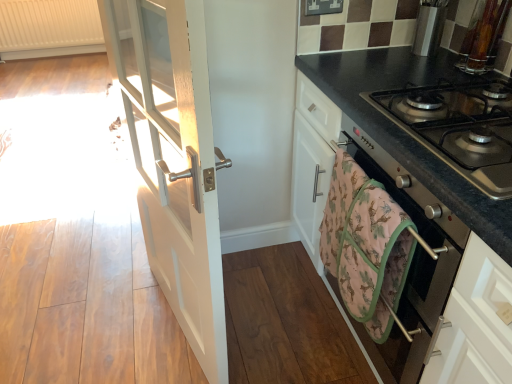
Question: Is the position of white wood door at left less distant than that of pink fabric hand towel at lower right?

Choices:
 (A) yes
 (B) no

Answer: (A)

Question: Could you tell me if white wood door at left is facing pink fabric hand towel at lower right?

Choices:
 (A) yes
 (B) no

Answer: (B)

Question: Is white wood door at left wider than pink fabric hand towel at lower right?

Choices:
 (A) no
 (B) yes

Answer: (A)

Question: Can you confirm if white wood door at left is bigger than pink fabric hand towel at lower right?

Choices:
 (A) no
 (B) yes

Answer: (B)

Question: Does white wood door at left have a lesser height compared to pink fabric hand towel at lower right?

Choices:
 (A) yes
 (B) no

Answer: (B)

Question: Is white wood door at left positioned far away from pink fabric hand towel at lower right?

Choices:
 (A) no
 (B) yes

Answer: (A)

Question: Is white wood door at left turned away from stainless steel gas stove at right?

Choices:
 (A) no
 (B) yes

Answer: (B)

Question: Is white wood door at left at the left side of stainless steel gas stove at right?

Choices:
 (A) no
 (B) yes

Answer: (B)

Question: Can we say white wood door at left lies outside stainless steel gas stove at right?

Choices:
 (A) no
 (B) yes

Answer: (B)

Question: Considering the relative sizes of white wood door at left and stainless steel gas stove at right in the image provided, is white wood door at left thinner than stainless steel gas stove at right?

Choices:
 (A) yes
 (B) no

Answer: (A)

Question: Is white wood door at left shorter than stainless steel gas stove at right?

Choices:
 (A) yes
 (B) no

Answer: (B)

Question: Can you confirm if white wood door at left is positioned to the right of stainless steel gas stove at right?

Choices:
 (A) yes
 (B) no

Answer: (B)

Question: Is white wood door at left outside of white textured radiator at upper left?

Choices:
 (A) no
 (B) yes

Answer: (B)